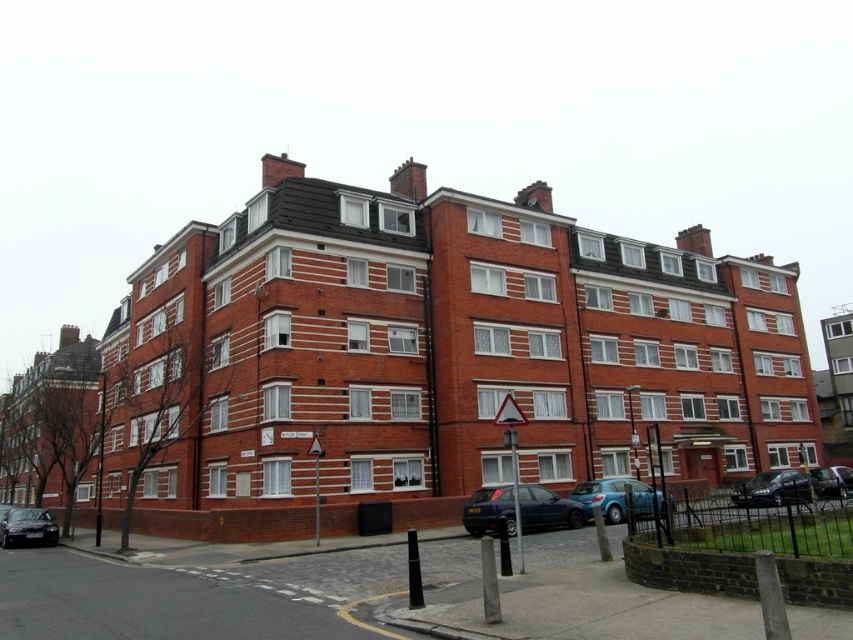
Does matte black car at center have a greater width compared to shiny black car at lower right?

Incorrect, matte black car at center's width does not surpass shiny black car at lower right's.

Is matte black car at center closer to the viewer compared to shiny black car at lower right?

Yes, matte black car at center is in front of shiny black car at lower right.

Find the location of a particular element. This screenshot has height=640, width=853. matte black car at center is located at coordinates (547, 508).

Can you confirm if shiny black car at lower right is taller than shiny black sedan at lower left?

Indeed, shiny black car at lower right has a greater height compared to shiny black sedan at lower left.

Between shiny black car at lower right and shiny black sedan at lower left, which one has less height?

shiny black sedan at lower left is shorter.

Find the location of `shiny black car at lower right`. shiny black car at lower right is located at coordinates (772, 488).

You are a GUI agent. You are given a task and a screenshot of the screen. Output one action in this format:
    pyautogui.click(x=<x>, y=<y>)
    Task: Click on the shiny black car at lower right
    
    Given the screenshot: What is the action you would take?
    pyautogui.click(x=772, y=488)

Is matte black car at center further to camera compared to shiny black sedan at lower left?

No, it is in front of shiny black sedan at lower left.

Who is higher up, matte black car at center or shiny black sedan at lower left?

Positioned higher is matte black car at center.

Does point (480, 497) lie behind point (45, 538)?

No, it is not.

This screenshot has height=640, width=853. Identify the location of matte black car at center. (547, 508).